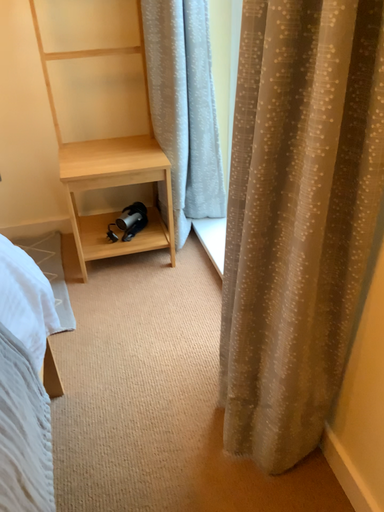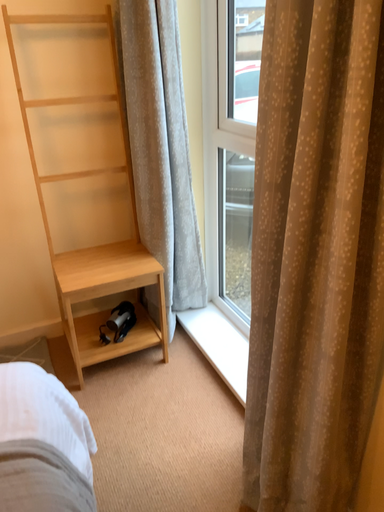
Question: How did the camera likely rotate when shooting the video?

Choices:
 (A) rotated upward
 (B) rotated downward

Answer: (A)